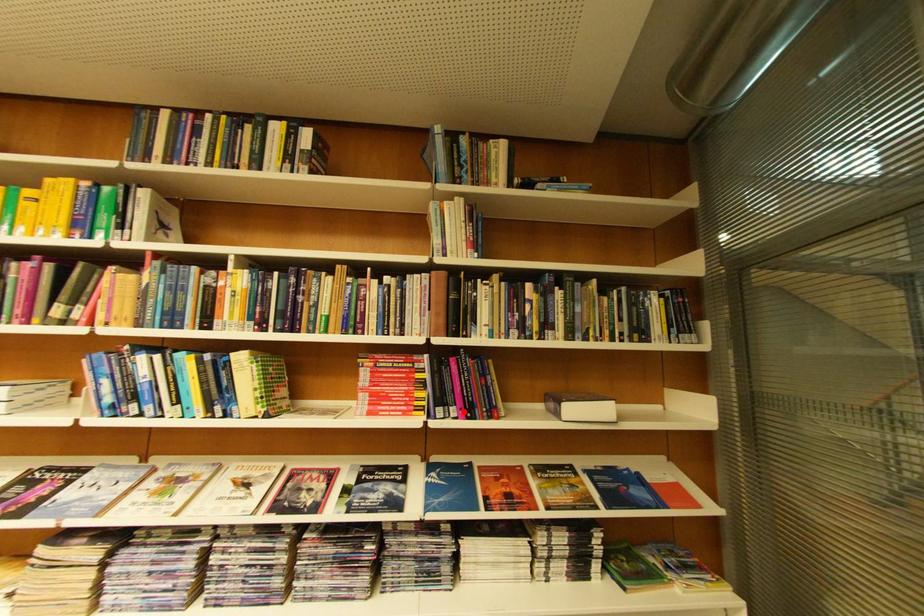
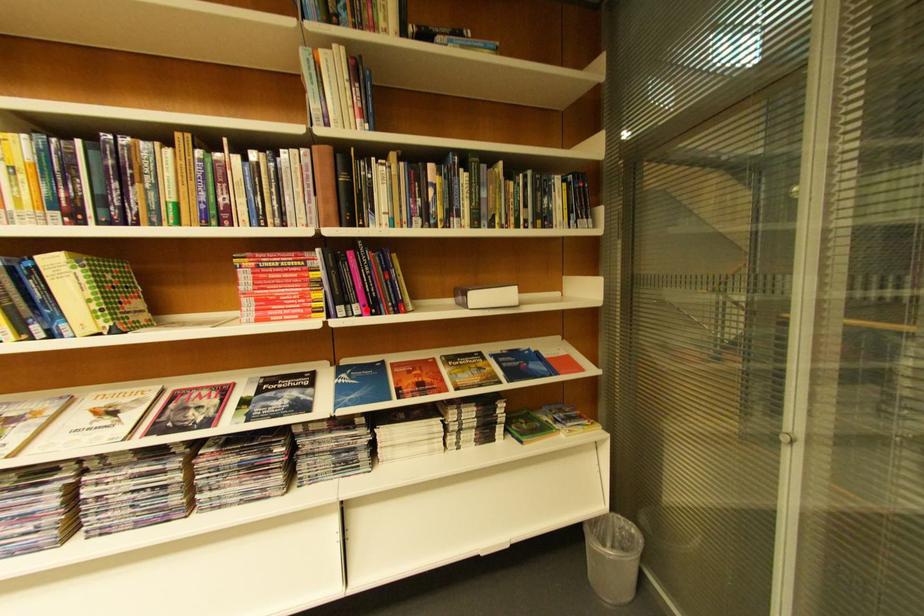
I am providing you with two images of the same scene from different viewpoints. A red point is marked on the first image and another point is marked on the second image. Is the red point in image1 aligned with the point shown in image2?

Yes